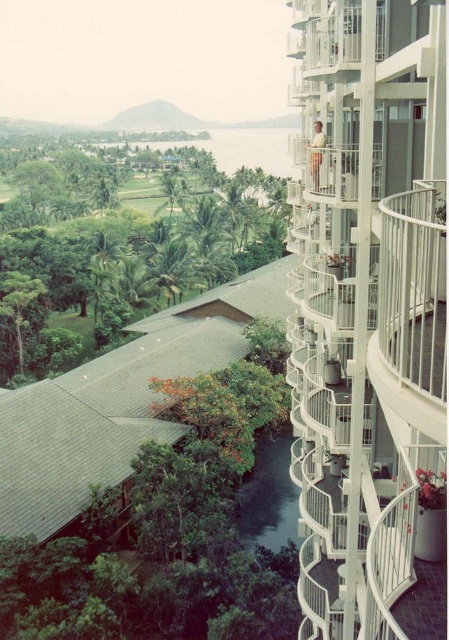
You are a painter wanting to capture the scene. You need to decide which object to focus on first based on their sizes. Which one is narrower between the white metal balcony at upper right and the green leafy tree at center?

The white metal balcony at upper right is narrower than the green leafy tree at center.

You are standing on the white metal balcony at upper right and want to see the top of the green leafy tree at center. Can you see the top of the tree from your current position?

The white metal balcony at upper right is not as tall as green leafy tree at center, so you cannot see the top of the tree from your current position because the balcony is shorter than the tree.

You are standing at the camera position and want to reach the point marked at coordinates point (343, 337). If you walk straight ahead, will you reach that point within 20 meters?

The distance between point (343, 337) and the camera is 17.60 meters, so yes, you can reach it within 20 meters by walking straight ahead.